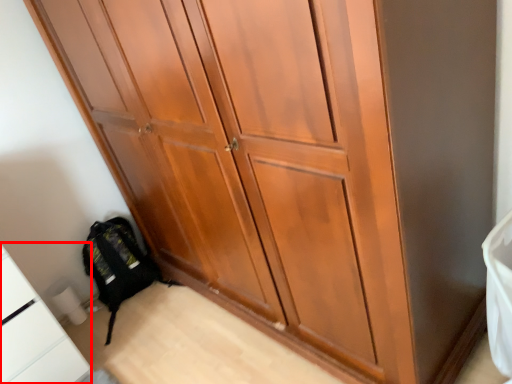
Question: In this image, where is cabinetry (annotated by the red box) located relative to backpack?

Choices:
 (A) left
 (B) right

Answer: (A)